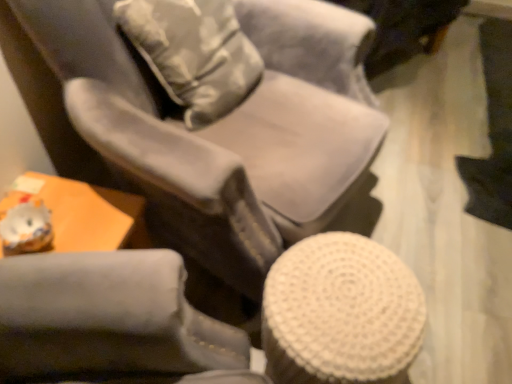
Question: Is white woven stool at lower right thinner than camouflage fabric throw pillow at upper center?

Choices:
 (A) yes
 (B) no

Answer: (B)

Question: Is white woven stool at lower right shorter than camouflage fabric throw pillow at upper center?

Choices:
 (A) no
 (B) yes

Answer: (B)

Question: Does white woven stool at lower right lie in front of camouflage fabric throw pillow at upper center?

Choices:
 (A) yes
 (B) no

Answer: (A)

Question: Considering the relative sizes of white woven stool at lower right and camouflage fabric throw pillow at upper center in the image provided, is white woven stool at lower right wider than camouflage fabric throw pillow at upper center?

Choices:
 (A) yes
 (B) no

Answer: (A)

Question: Are white woven stool at lower right and camouflage fabric throw pillow at upper center located far from each other?

Choices:
 (A) yes
 (B) no

Answer: (B)

Question: In terms of width, does white woven stool at lower right look wider or thinner when compared to camouflage fabric throw pillow at upper center?

Choices:
 (A) wide
 (B) thin

Answer: (A)

Question: Does point (411, 311) appear closer or farther from the camera than point (185, 36)?

Choices:
 (A) farther
 (B) closer

Answer: (B)

Question: From the image's perspective, is white woven stool at lower right located above or below camouflage fabric throw pillow at upper center?

Choices:
 (A) below
 (B) above

Answer: (A)

Question: In terms of height, does white woven stool at lower right look taller or shorter compared to camouflage fabric throw pillow at upper center?

Choices:
 (A) short
 (B) tall

Answer: (A)

Question: Is camouflage fabric throw pillow at upper center in front of or behind suede-like gray chair at center in the image?

Choices:
 (A) front
 (B) behind

Answer: (B)

Question: From a real-world perspective, is camouflage fabric throw pillow at upper center above or below suede-like gray chair at center?

Choices:
 (A) below
 (B) above

Answer: (B)

Question: Considering the relative positions of camouflage fabric throw pillow at upper center and suede-like gray chair at center in the image provided, is camouflage fabric throw pillow at upper center to the left or to the right of suede-like gray chair at center?

Choices:
 (A) right
 (B) left

Answer: (B)

Question: Is camouflage fabric throw pillow at upper center situated inside suede-like gray chair at center or outside?

Choices:
 (A) outside
 (B) inside

Answer: (B)

Question: Looking at their shapes, would you say white woven stool at lower right is wider or thinner than suede-like gray chair at center?

Choices:
 (A) wide
 (B) thin

Answer: (B)

Question: Based on their positions, is white woven stool at lower right located to the left or right of suede-like gray chair at center?

Choices:
 (A) right
 (B) left

Answer: (A)